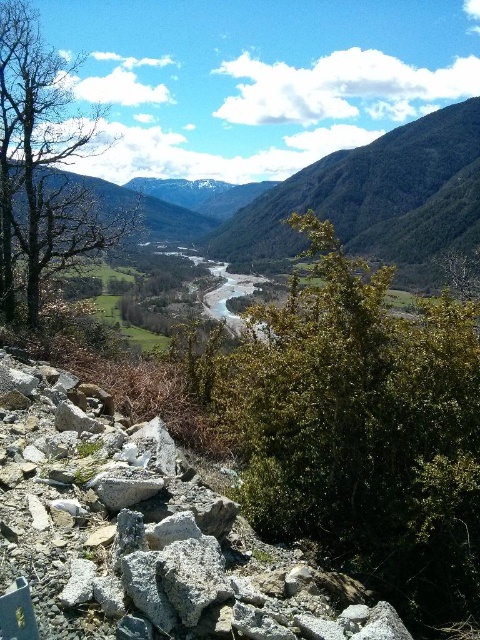
Question: Does green leafy bush at center have a smaller size compared to gray rough rock at lower left?

Choices:
 (A) no
 (B) yes

Answer: (A)

Question: Which point is farther to the camera?

Choices:
 (A) green textured mountain at center
 (B) green leafy bush at center

Answer: (A)

Question: Which point is farther to the camera?

Choices:
 (A) (41, 113)
 (B) (37, 412)

Answer: (A)

Question: Does green leafy bush at center appear on the left side of bare wood tree at left?

Choices:
 (A) no
 (B) yes

Answer: (A)

Question: Which is farther from the green leafy bush at center?

Choices:
 (A) bare wood tree at left
 (B) green textured mountain at center
 (C) gray rough rock at lower left

Answer: (B)

Question: Does green leafy bush at center have a larger size compared to green textured mountain at center?

Choices:
 (A) no
 (B) yes

Answer: (A)